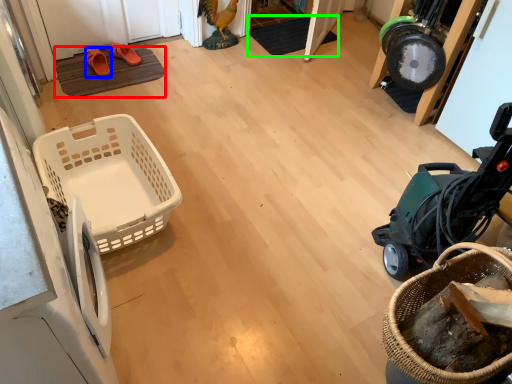
Question: Which object is positioned farthest from doormat (highlighted by a red box)? Select from footwear (highlighted by a blue box) and doormat (highlighted by a green box).

Choices:
 (A) footwear
 (B) doormat

Answer: (B)